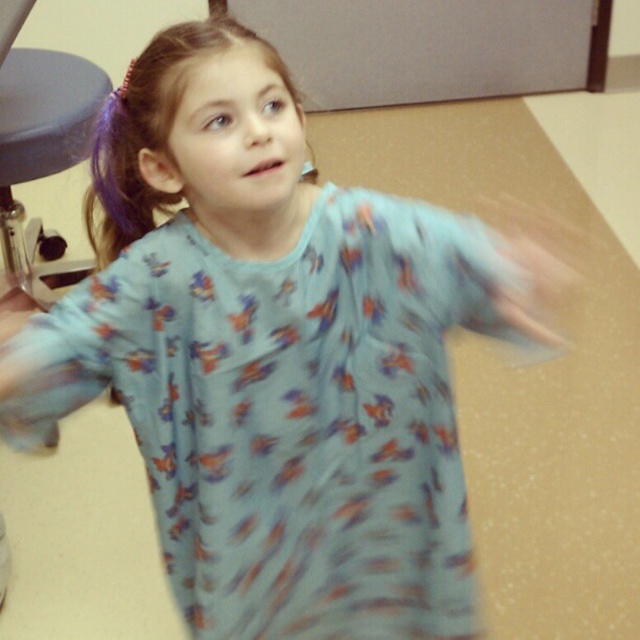
Question: Which object is positioned closest to the purple silky hair at upper left?

Choices:
 (A) matte skin hand at lower left
 (B) matte gray swivel chair at left

Answer: (A)

Question: Which point appears closest to the camera in this image?

Choices:
 (A) (32, 131)
 (B) (218, 24)

Answer: (B)

Question: Can you confirm if purple silky hair at upper left is positioned to the right of matte skin hand at lower left?

Choices:
 (A) yes
 (B) no

Answer: (A)

Question: Can you confirm if purple silky hair at upper left is positioned above matte skin hand at lower left?

Choices:
 (A) yes
 (B) no

Answer: (A)

Question: Is purple silky hair at upper left bigger than matte gray swivel chair at left?

Choices:
 (A) yes
 (B) no

Answer: (B)

Question: Considering the real-world distances, which object is farthest from the matte skin hand at lower left?

Choices:
 (A) purple silky hair at upper left
 (B) matte gray swivel chair at left

Answer: (A)